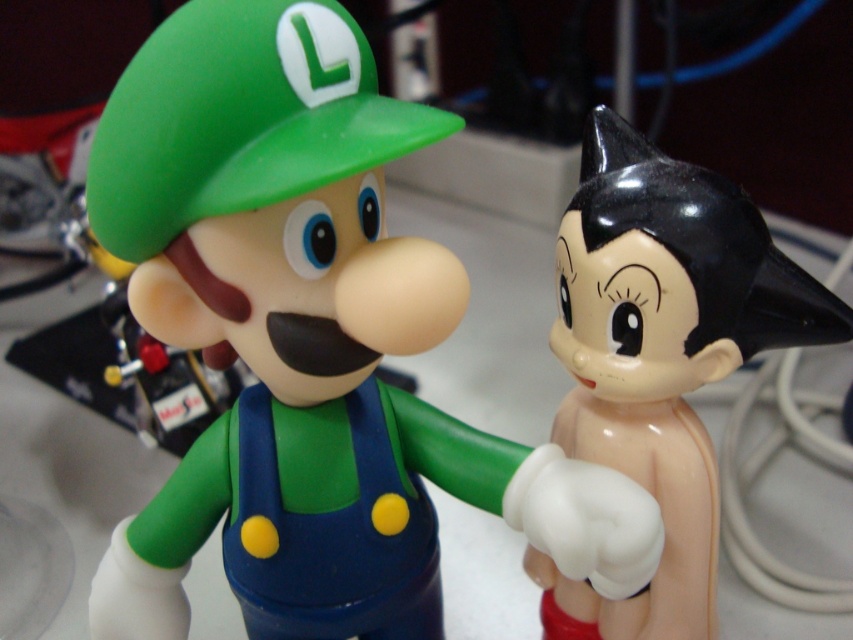
Question: Can you confirm if matte plastic luigi figure at center is positioned to the right of glossy plastic figure at right?

Choices:
 (A) no
 (B) yes

Answer: (A)

Question: Among these objects, which one is nearest to the camera?

Choices:
 (A) glossy plastic figure at right
 (B) matte plastic luigi figure at center

Answer: (B)

Question: Which point appears farthest from the camera in this image?

Choices:
 (A) (247, 3)
 (B) (636, 369)

Answer: (B)

Question: Does matte plastic luigi figure at center have a larger size compared to glossy plastic figure at right?

Choices:
 (A) yes
 (B) no

Answer: (A)

Question: Which of the following is the closest to the observer?

Choices:
 (A) (456, 484)
 (B) (689, 348)

Answer: (B)

Question: Can you confirm if matte plastic luigi figure at center is thinner than glossy plastic figure at right?

Choices:
 (A) no
 (B) yes

Answer: (A)